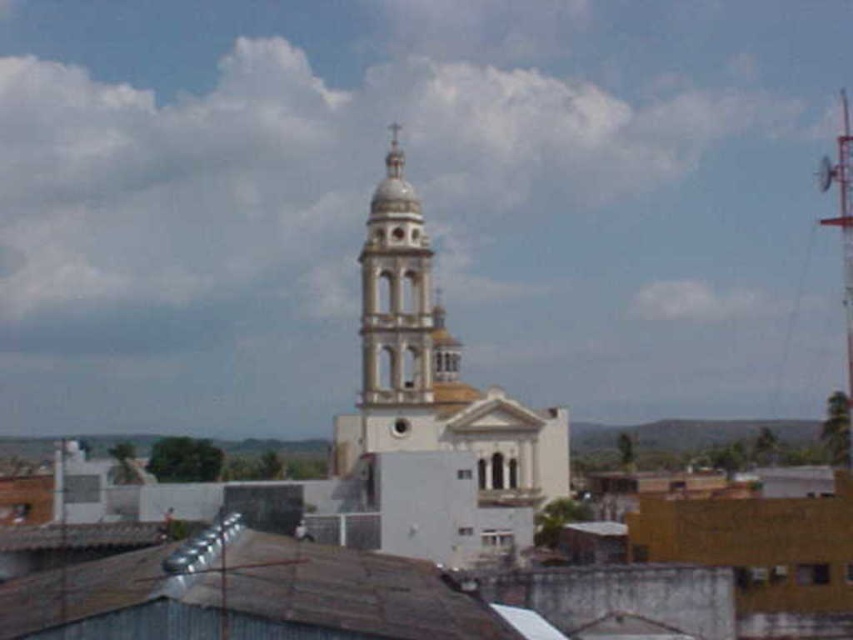
You are a tourist standing in the town square and want to take a photo of the white stone church at center and the white stone bell tower at center. Which one should you focus on first if you want to capture both in the frame without moving the camera?

The white stone church at center is positioned over the white stone bell tower at center, so you should focus on the white stone bell tower at center first to ensure both are in the frame.

You are standing in the town square looking at the church. There are two points marked on the image. Which point, point (x=419, y=432) or point (x=408, y=294), is closer to you?

Point (x=419, y=432) is closer to the viewer than point (x=408, y=294).

In the scene shown: You are an architect analyzing the town layout. You need to determine which structure occupies more space in the image between the white stone church at center and the white stone bell tower at center. Which one is bigger?

The white stone church at center is larger in size compared to the white stone bell tower at center, so it occupies more space in the image.